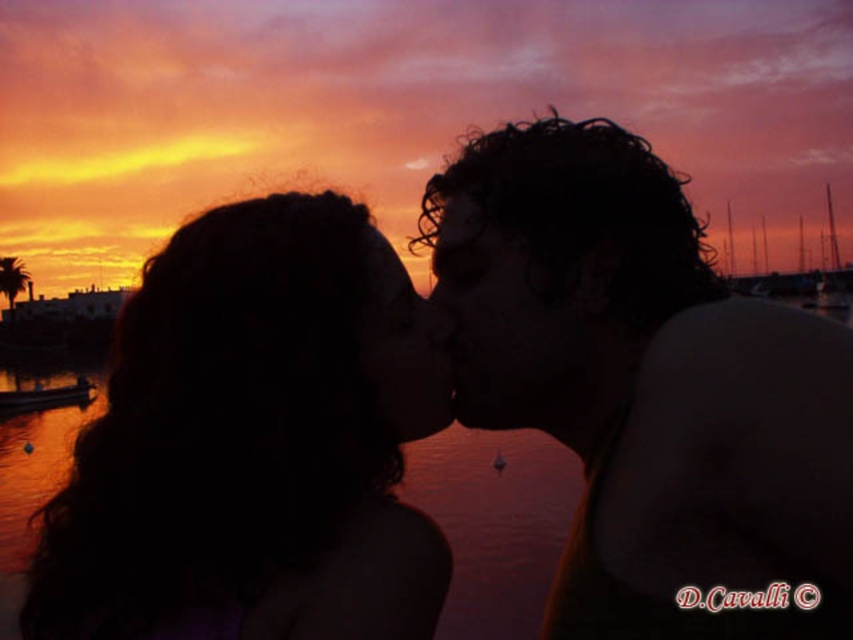
Which of these two, dark curly hair at center or dark hair at center, stands shorter?

With less height is dark hair at center.

Which is below, dark curly hair at center or dark hair at center?

dark hair at center is lower down.

Is point (824, 563) behind point (328, 432)?

No, (824, 563) is in front of (328, 432).

You are a GUI agent. You are given a task and a screenshot of the screen. Output one action in this format:
    pyautogui.click(x=<x>, y=<y>)
    Task: Click on the dark curly hair at center
    
    Given the screenshot: What is the action you would take?
    pyautogui.click(x=647, y=390)

Is smooth skin forehead at center taller than wooden boat at lower left?

No.

Locate an element on the screen. The width and height of the screenshot is (853, 640). smooth skin forehead at center is located at coordinates (384, 268).

Locate an element on the screen. The height and width of the screenshot is (640, 853). smooth skin forehead at center is located at coordinates (384, 268).

Which is in front, point (361, 499) or point (20, 390)?

Point (361, 499) is more forward.

At what (x,y) coordinates should I click in order to perform the action: click on dark hair at center. Please return your answer as a coordinate pair (x, y). This screenshot has height=640, width=853. Looking at the image, I should click on (252, 444).

This screenshot has width=853, height=640. Find the location of `dark hair at center`. dark hair at center is located at coordinates (252, 444).